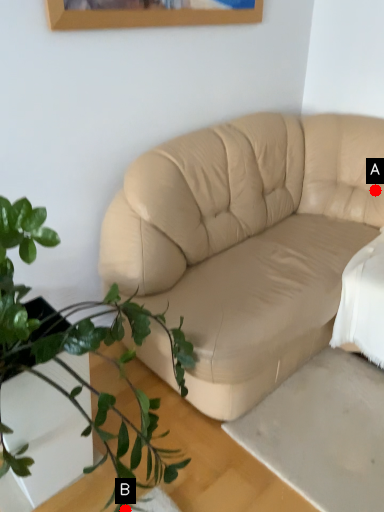
Question: Two points are circled on the image, labeled by A and B beside each circle. Which point is farther from the camera taking this photo?

Choices:
 (A) A is further
 (B) B is further

Answer: (A)